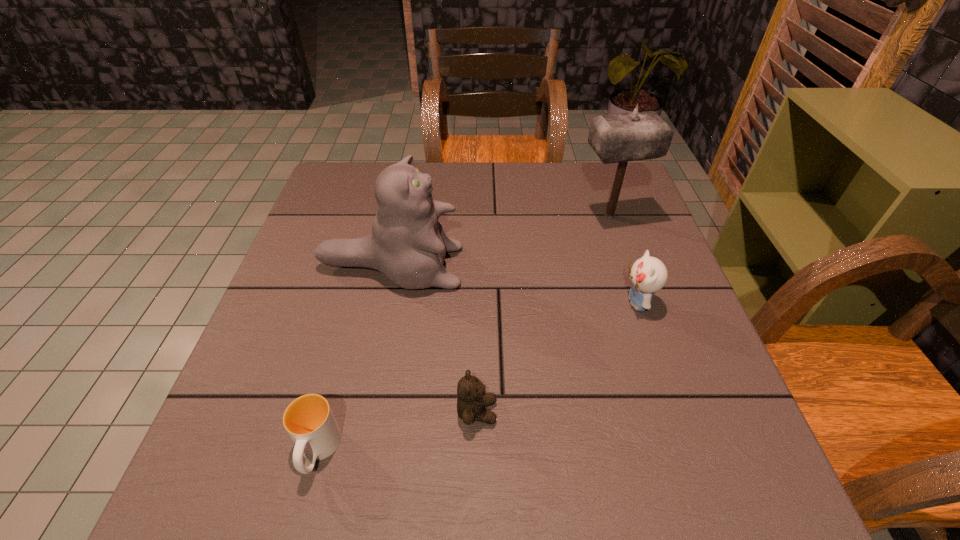
What are the coordinates of `the farthest object` in the screenshot? It's located at (616, 138).

Find the location of `cat`. cat is located at coordinates (407, 244).

At what (x,y) coordinates should I click in order to perform the action: click on kitten. Please return your answer as a coordinate pair (x, y). The width and height of the screenshot is (960, 540). Looking at the image, I should click on (648, 274).

Identify the location of teddy bear. [x=472, y=400].

Image resolution: width=960 pixels, height=540 pixels. Identify the location of cup. (309, 421).

This screenshot has height=540, width=960. I want to click on vacant region located 0.050m on the back of the farthest object, so click(601, 192).

Locate an element on the screen. The height and width of the screenshot is (540, 960). free space located on the face of the cat is located at coordinates (525, 267).

Where is `free space located on the front-facing side of the third shortest object`? free space located on the front-facing side of the third shortest object is located at coordinates (455, 302).

Where is `vacant space located on the front-facing side of the third shortest object`? vacant space located on the front-facing side of the third shortest object is located at coordinates (556, 302).

The width and height of the screenshot is (960, 540). In order to click on free space located on the front-facing side of the third shortest object in this screenshot , I will do `click(593, 302)`.